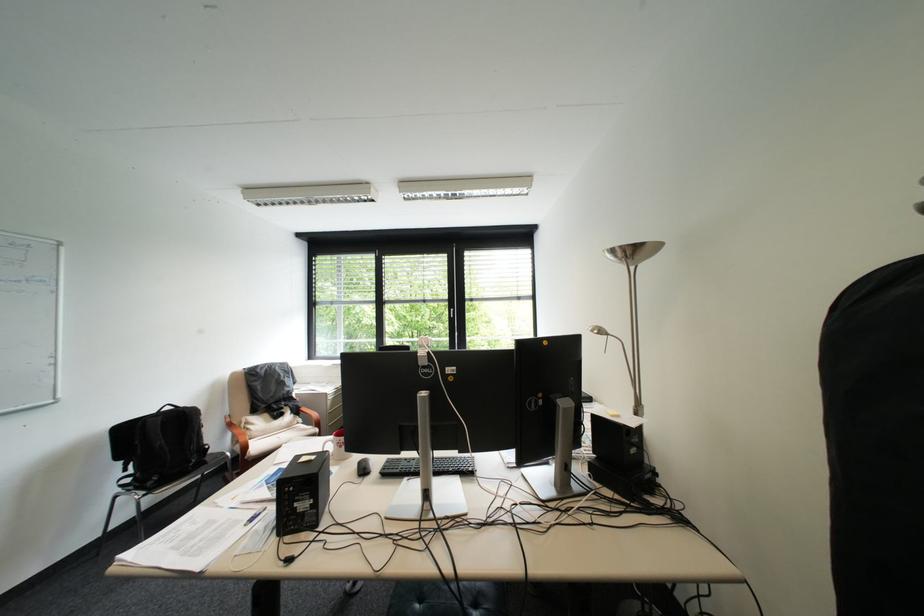
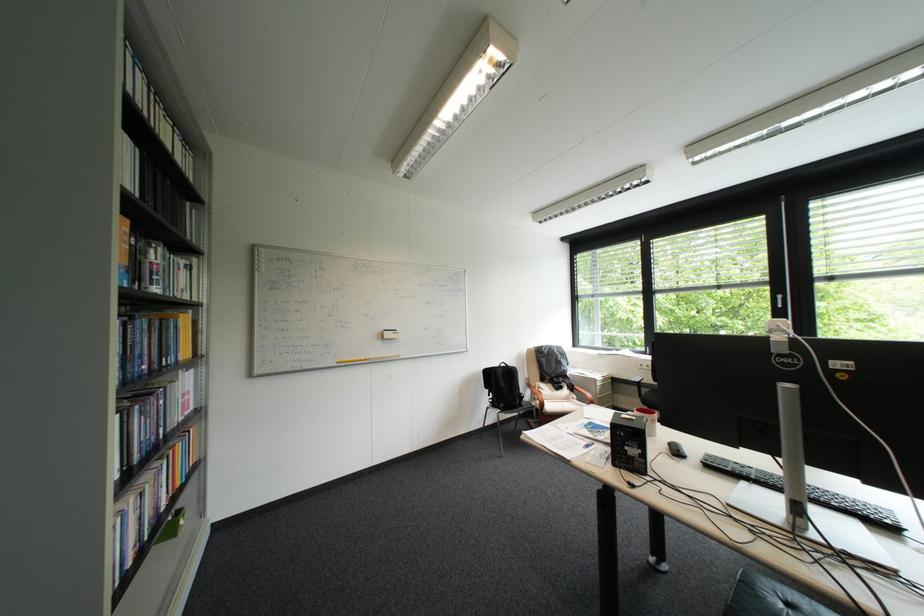
Where in the second image is the point corresponding to pixel 418 480 from the first image?

(757, 484)